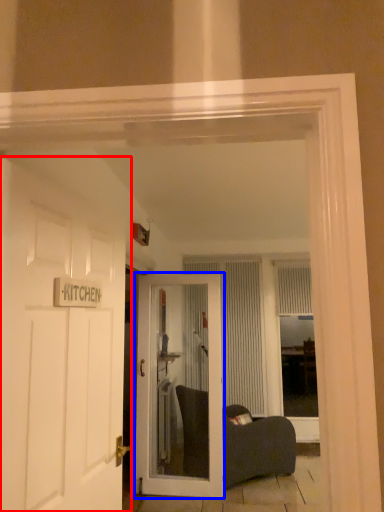
Question: Among these objects, which one is farthest to the camera, door (highlighted by a red box) or door (highlighted by a blue box)?

Choices:
 (A) door
 (B) door

Answer: (B)